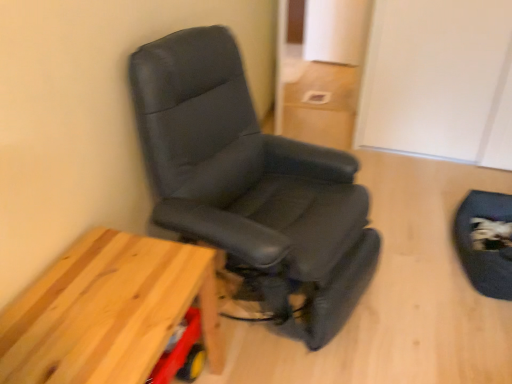
Question: Considering the positions of wooden table at lower left and black leather chair at left in the image, is wooden table at lower left wider or thinner than black leather chair at left?

Choices:
 (A) thin
 (B) wide

Answer: (A)

Question: Do you think wooden table at lower left is within black leather chair at left, or outside of it?

Choices:
 (A) inside
 (B) outside

Answer: (B)

Question: Which object is positioned closest to the black leather swivel chair at lower right?

Choices:
 (A) black leather chair at left
 (B) wooden table at lower left

Answer: (A)

Question: Considering the real-world distances, which object is closest to the black leather chair at left?

Choices:
 (A) black leather swivel chair at lower right
 (B) wooden table at lower left

Answer: (B)